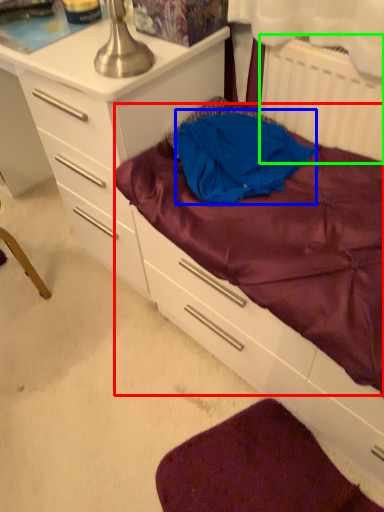
Question: Which object is the closest to the mattress (highlighted by a red box)? Choose among these: clothing (highlighted by a blue box) or radiator (highlighted by a green box).

Choices:
 (A) clothing
 (B) radiator

Answer: (A)